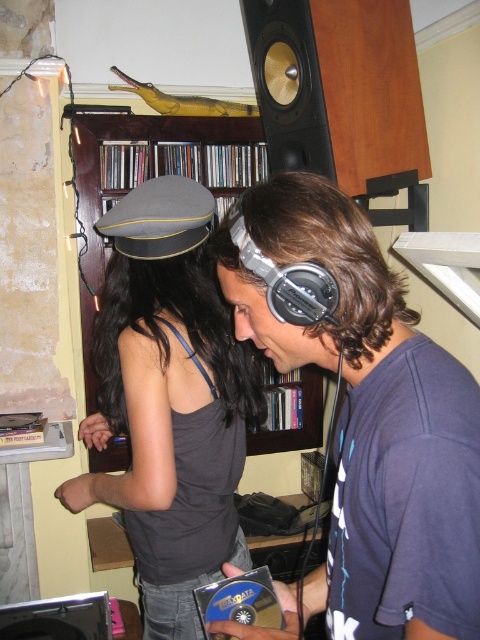
Question: Is matte black headphones at center to the left of matte gray cap at center from the viewer's perspective?

Choices:
 (A) yes
 (B) no

Answer: (B)

Question: Is matte gray cap at center wider than wooden bookshelf at upper center?

Choices:
 (A) yes
 (B) no

Answer: (B)

Question: Which is farther from the matte gray cap at center?

Choices:
 (A) matte black headphones at center
 (B) wooden speaker at upper right

Answer: (B)

Question: From the image, what is the correct spatial relationship of matte black headphones at center in relation to wooden bookshelf at upper center?

Choices:
 (A) above
 (B) below

Answer: (B)

Question: Which point appears farthest from the camera in this image?

Choices:
 (A) (109, 488)
 (B) (310, 376)
 (C) (384, 365)

Answer: (B)

Question: Which point is farther to the camera?

Choices:
 (A) (171, 445)
 (B) (254, 282)

Answer: (A)